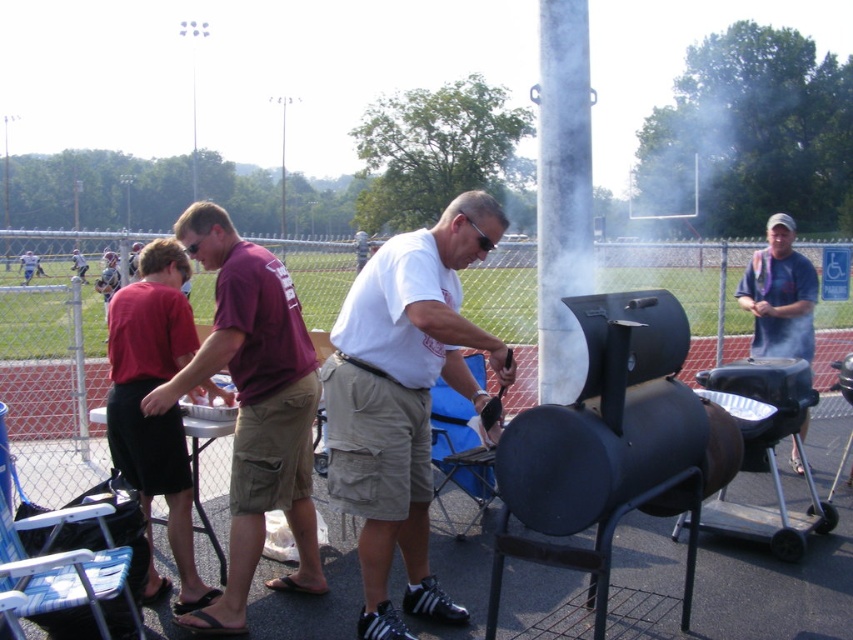
Question: Does white matte shirt at center appear over blue fabric shirt at right?

Choices:
 (A) yes
 (B) no

Answer: (B)

Question: From the image, what is the correct spatial relationship of white matte shirt at center in relation to maroon fabric shirt at center?

Choices:
 (A) below
 (B) above

Answer: (B)

Question: Can you confirm if black matte barbecue grill at center is positioned above blue fabric shirt at right?

Choices:
 (A) yes
 (B) no

Answer: (B)

Question: Which object appears closest to the camera in this image?

Choices:
 (A) black matte barbecue grill at center
 (B) blue fabric shirt at right
 (C) white matte shirt at center

Answer: (A)

Question: Which object is farther from the camera taking this photo?

Choices:
 (A) maroon fabric shirt at center
 (B) white matte shirt at center

Answer: (A)

Question: Which object is closer to the camera taking this photo?

Choices:
 (A) maroon t-shirt at center
 (B) black matte barbecue grill at center
 (C) white matte shirt at center
 (D) blue fabric shirt at right

Answer: (B)